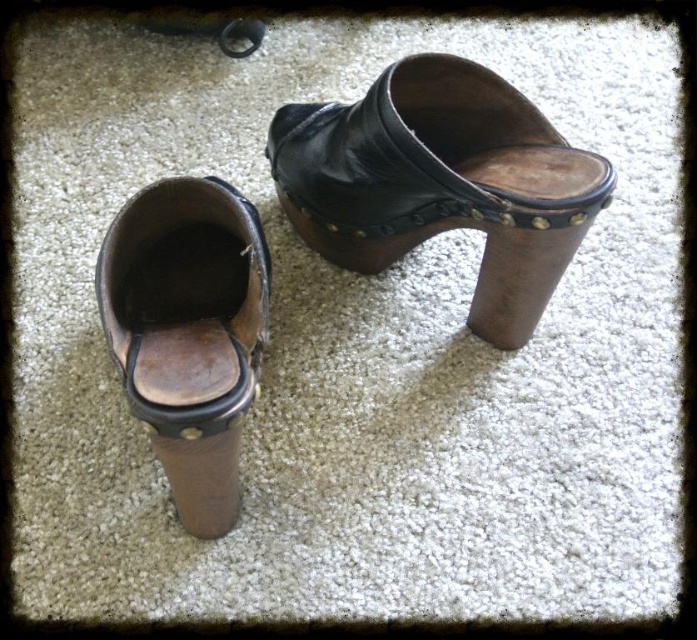
You are standing in a room and see the black leather clog at center and the brown leather clog at left. Which clog is positioned higher from the ground?

The black leather clog at center is above the brown leather clog at left, so it is positioned higher from the ground.

You are standing in a room with these two clogs. You need to place a small decorative pillow between them. Which clog should you place the pillow closer to, the black leather clog at center or the brown leather clog at left?

The black leather clog at center is positioned on the right side of the brown leather clog at left, so placing the pillow closer to the brown leather clog at left would keep it between them.